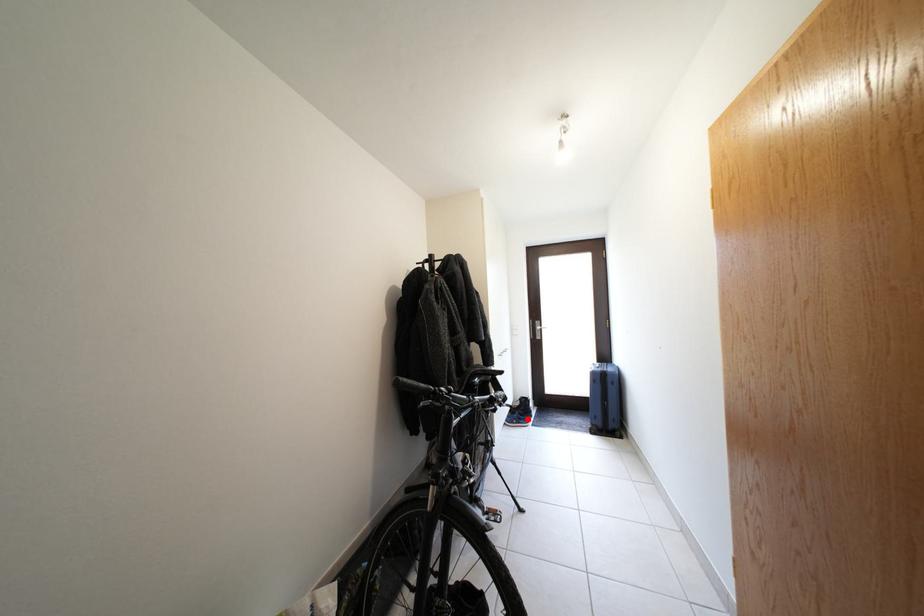
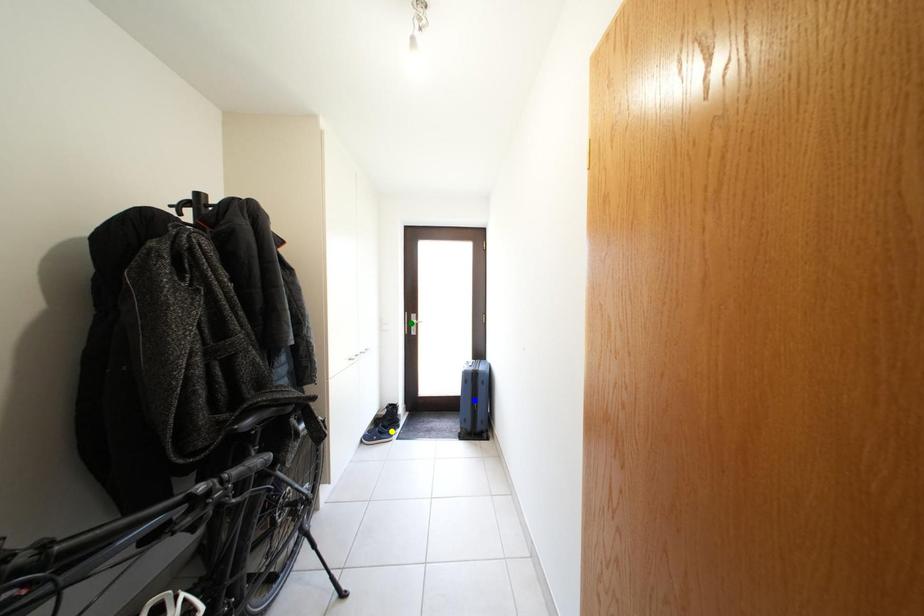
Question: I am providing you with two images of the same scene from different viewpoints. A red point is marked on the first image. You are given multiple points on the second image. Which point in image 2 represents the same 3d spot as the red point in image 1?

Choices:
 (A) yellow point
 (B) blue point
 (C) green point

Answer: (A)